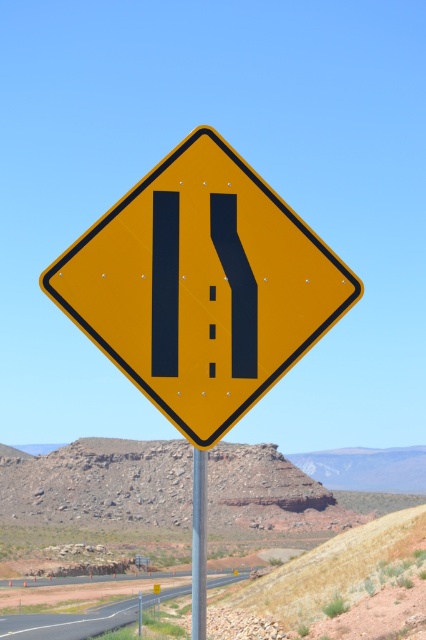
Question: Is asphalt road at lower center to the left of metallic silver pole at center from the viewer's perspective?

Choices:
 (A) yes
 (B) no

Answer: (A)

Question: Which object is the farthest from the metallic silver pole at center?

Choices:
 (A) asphalt road at lower center
 (B) yellow matte road sign at center

Answer: (A)

Question: Which object appears closest to the camera in this image?

Choices:
 (A) metallic silver pole at center
 (B) yellow matte road sign at center

Answer: (B)

Question: Is yellow matte road sign at center to the left of metallic silver pole at center from the viewer's perspective?

Choices:
 (A) no
 (B) yes

Answer: (A)

Question: Estimate the real-world distances between objects in this image. Which object is closer to the metallic silver pole at center?

Choices:
 (A) yellow matte road sign at center
 (B) asphalt road at lower center

Answer: (A)

Question: Is yellow matte road sign at center below asphalt road at lower center?

Choices:
 (A) yes
 (B) no

Answer: (B)